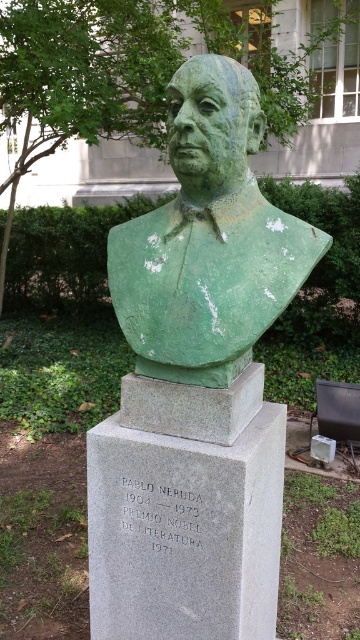
You are an art conservator assessing the bronze bust of Pablo Neruda. You notice two distinct areas on the sculpture labeled as the green matte bust at center and the green patina bust at center. Which area is closer to you?

The green matte bust at center is closer to you since it is only 7.37 inches away from the green patina bust at center, implying that the matte area is in front of the patina area.

You are an art conservator assessing the bronze bust of Pablo Neruda. The bust is represented by the point at coordinates (208, 237). To ensure proper preservation, you need to know its exact location. Where is the bust located in the image?

The green matte bust at center is represented by the point at coordinates (208, 237), so the bust is located at the center of the image.